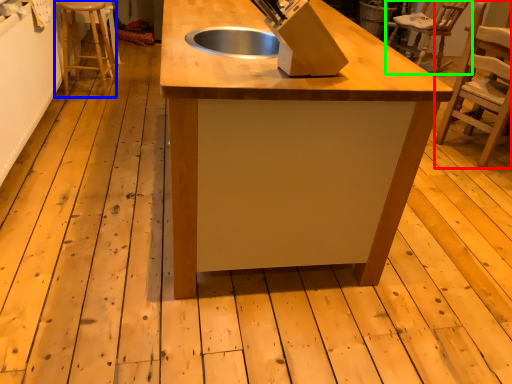
Question: Considering the real-world distances, which object is farthest from chair (highlighted by a red box)? step stool (highlighted by a blue box) or chair (highlighted by a green box)?

Choices:
 (A) step stool
 (B) chair

Answer: (A)